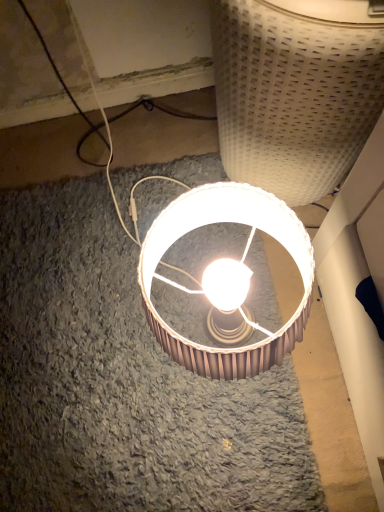
Describe the element at coordinates (296, 90) in the screenshot. I see `white woven basket at upper right` at that location.

Where is `white woven basket at upper right`? The image size is (384, 512). white woven basket at upper right is located at coordinates (296, 90).

The height and width of the screenshot is (512, 384). I want to click on white woven basket at upper right, so click(x=296, y=90).